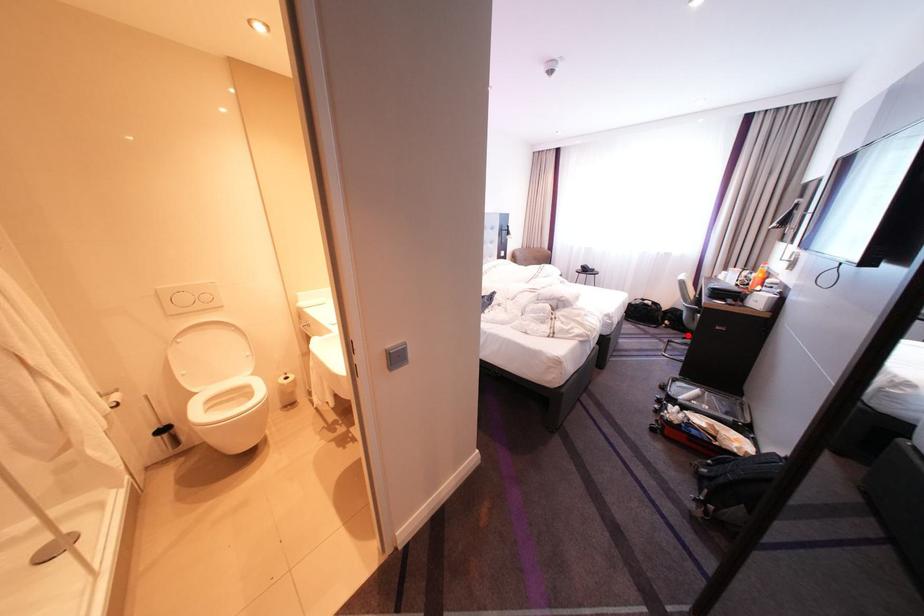
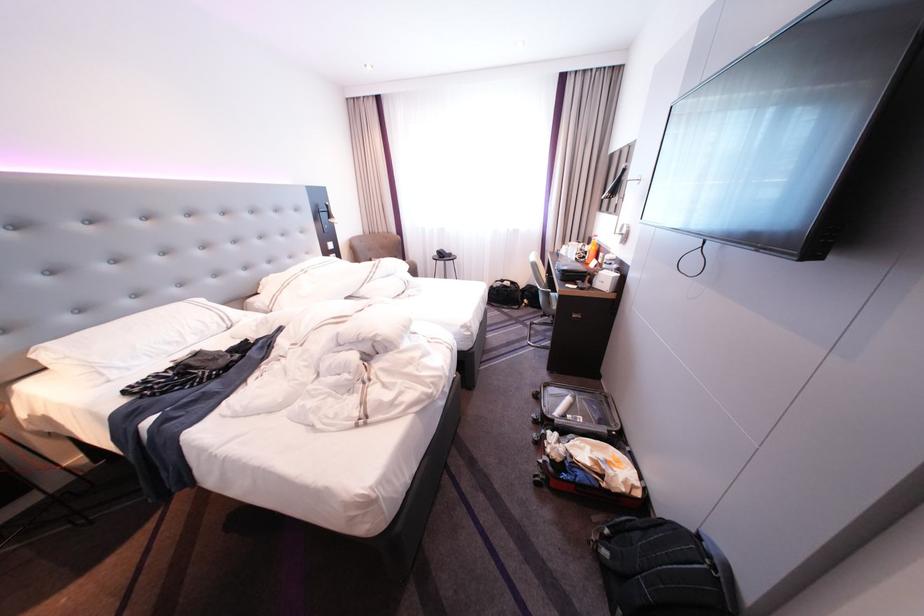
Where in the second image is the point corresponding to the highlighted location from the first image?

(546, 314)